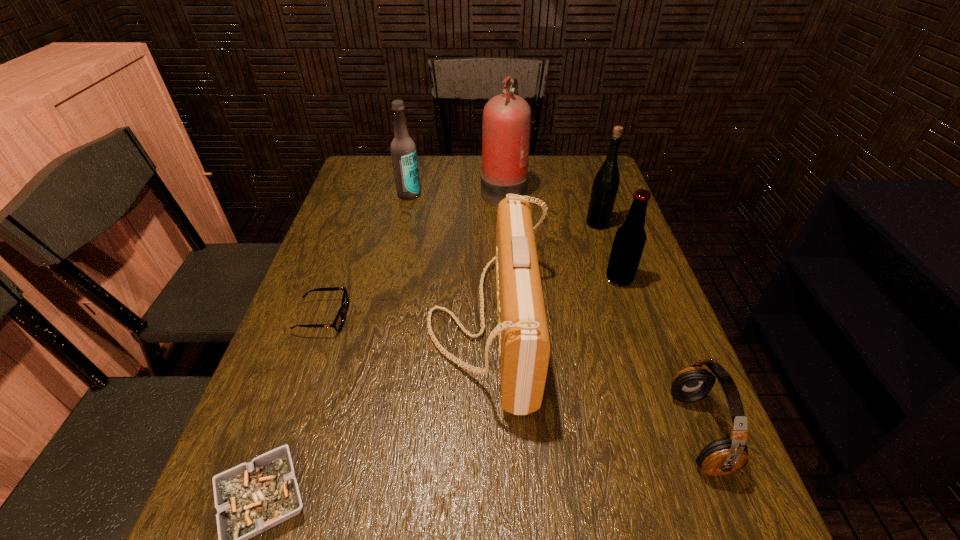
Find the location of `free point located 0.240m at the nozzle of the tallest object`. free point located 0.240m at the nozzle of the tallest object is located at coordinates (405, 189).

Where is `free spot located on the label of the leftmost beer bottle`? free spot located on the label of the leftmost beer bottle is located at coordinates (401, 231).

Where is `vacant region located on the left of the second nearest beer bottle`? vacant region located on the left of the second nearest beer bottle is located at coordinates (557, 224).

Find the location of a particular element. free location located on the decorative side of the handbag is located at coordinates (365, 324).

In order to click on vacant space located on the decorative side of the handbag in this screenshot , I will do `click(351, 324)`.

Where is `free location located on the decorative side of the handbag`? free location located on the decorative side of the handbag is located at coordinates (382, 324).

Find the location of a particular element. This screenshot has width=960, height=540. free point located on the front of the shortest beer bottle is located at coordinates (639, 340).

At what (x,y) coordinates should I click in order to perform the action: click on free space located 0.200m on the ear cups of the headset. Please return your answer as a coordinate pair (x, y). Looking at the image, I should click on (567, 431).

Identify the location of vacant space located on the ear cups of the headset. The image size is (960, 540). (463, 431).

What are the coordinates of `vacant region located on the ear cups of the headset` in the screenshot? It's located at (600, 431).